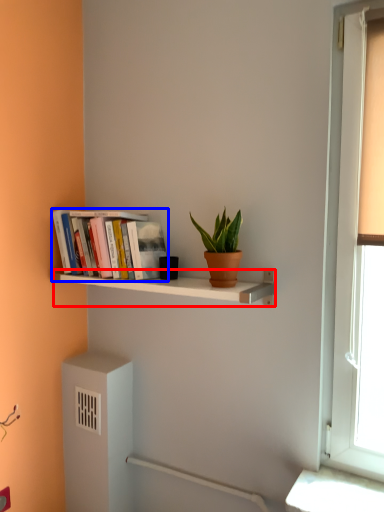
Question: Which point is closer to the camera, shelf (highlighted by a red box) or book (highlighted by a blue box)?

Choices:
 (A) shelf
 (B) book

Answer: (A)